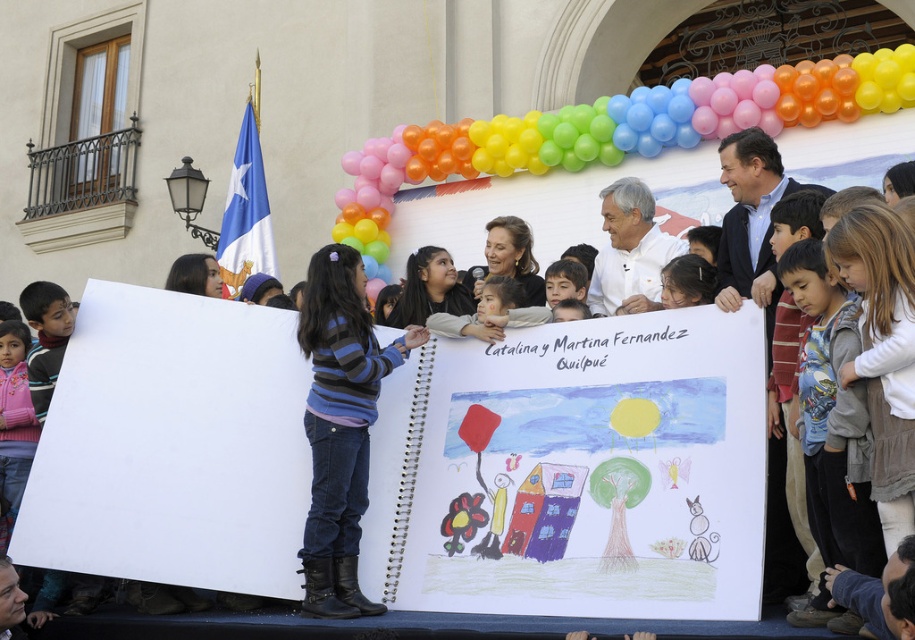
You are an artist who needs to choose between the white paper at center and the gray sweater at lower right to place your new drawing. Which object is bigger and more suitable for a large artwork?

The white paper at center is larger in size than the gray sweater at lower right, making it more suitable for a large artwork.

You are an artist trying to display your artwork. You have a white paper at center and a striped sweater at center. Which item can you use to cover a larger area on the stage?

The white paper at center has a larger width than the striped sweater at center, so it can cover a larger area on the stage.

You are an event photographer at the community gathering. You need to capture a photo that includes both the white paper at center and the gray sweater at lower right. Based on their positions, which object should be placed on the left side of the photo frame?

The white paper at center should be placed on the left side of the photo frame since it is to the left of the gray sweater at lower right.